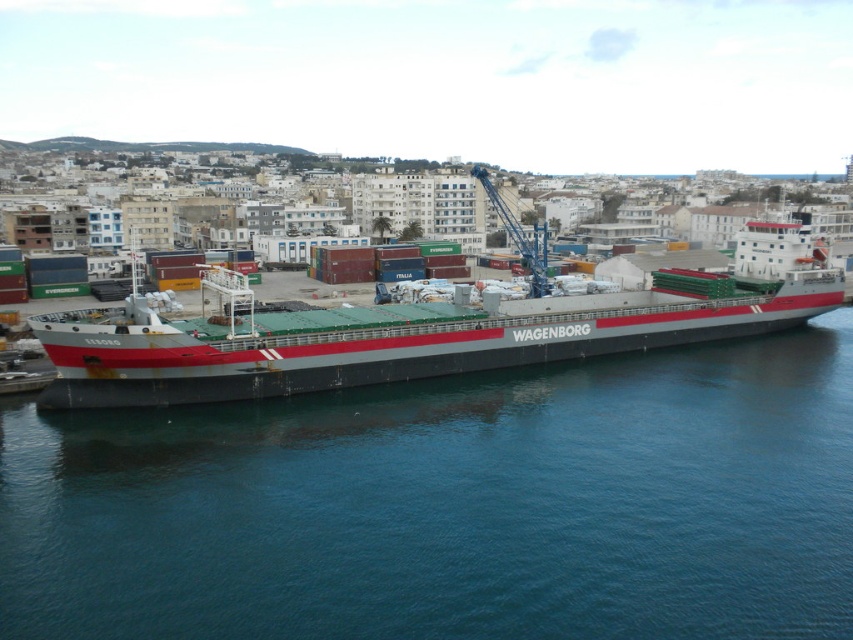
Based on the photo, measure the distance between point (412,627) and camera.

Point (412,627) is 33.06 meters away from camera.

Is smooth dark blue water at center above gray matte cargo ship at center?

Incorrect, smooth dark blue water at center is not positioned above gray matte cargo ship at center.

You are a GUI agent. You are given a task and a screenshot of the screen. Output one action in this format:
    pyautogui.click(x=<x>, y=<y>)
    Task: Click on the smooth dark blue water at center
    This screenshot has width=853, height=640.
    Given the screenshot: What is the action you would take?
    pyautogui.click(x=451, y=504)